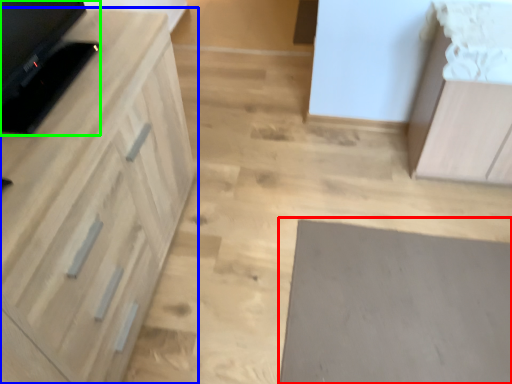
Question: Which is farther away from mat (highlighted by a red box)? cabinetry (highlighted by a blue box) or appliance (highlighted by a green box)?

Choices:
 (A) cabinetry
 (B) appliance

Answer: (B)